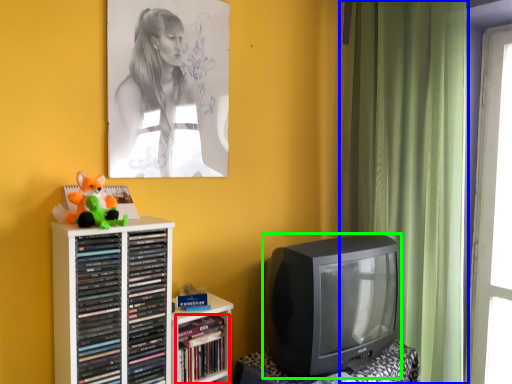
Question: Estimate the real-world distances between objects in this image. Which object is closer to book (highlighted by a red box), curtain (highlighted by a blue box) or television (highlighted by a green box)?

Choices:
 (A) curtain
 (B) television

Answer: (B)